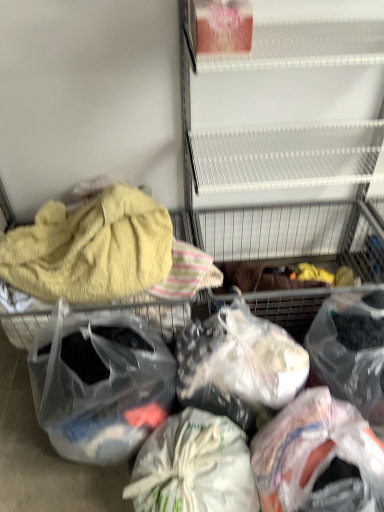
Question: Is translucent plastic bag at lower right, positioned as the 5th plastic bag in left-to-right order, thinner than yellow fluffy towel at left?

Choices:
 (A) yes
 (B) no

Answer: (A)

Question: Does translucent plastic bag at lower right, positioned as the 5th plastic bag in left-to-right order, have a lesser height compared to yellow fluffy towel at left?

Choices:
 (A) no
 (B) yes

Answer: (A)

Question: Does translucent plastic bag at lower right, positioned as the 1th plastic bag in right-to-left order, have a greater width compared to yellow fluffy towel at left?

Choices:
 (A) yes
 (B) no

Answer: (B)

Question: Is translucent plastic bag at lower right, positioned as the 1th plastic bag in right-to-left order, looking in the opposite direction of yellow fluffy towel at left?

Choices:
 (A) yes
 (B) no

Answer: (B)

Question: Can you see translucent plastic bag at lower right, positioned as the 1th plastic bag in right-to-left order, touching yellow fluffy towel at left?

Choices:
 (A) no
 (B) yes

Answer: (A)

Question: Is translucent plastic bag at lower right, positioned as the 5th plastic bag in left-to-right order, closer to camera compared to yellow fluffy towel at left?

Choices:
 (A) yes
 (B) no

Answer: (A)

Question: Is yellow fluffy towel at left aimed at white fabric bag at center, acting as the 4th plastic bag starting from the right?

Choices:
 (A) yes
 (B) no

Answer: (B)

Question: Is yellow fluffy towel at left positioned before white fabric bag at center, acting as the 4th plastic bag starting from the right?

Choices:
 (A) yes
 (B) no

Answer: (B)

Question: Is yellow fluffy towel at left to the left of white fabric bag at center, which is the second plastic bag in left-to-right order, from the viewer's perspective?

Choices:
 (A) yes
 (B) no

Answer: (A)

Question: Is yellow fluffy towel at left far away from white fabric bag at center, acting as the 4th plastic bag starting from the right?

Choices:
 (A) no
 (B) yes

Answer: (A)

Question: Can you confirm if yellow fluffy towel at left is bigger than white fabric bag at center, which is the second plastic bag in left-to-right order?

Choices:
 (A) no
 (B) yes

Answer: (B)

Question: Considering the relative positions of yellow fluffy towel at left and white fabric bag at center, which is the second plastic bag in left-to-right order, in the image provided, is yellow fluffy towel at left behind white fabric bag at center, which is the second plastic bag in left-to-right order,?

Choices:
 (A) yes
 (B) no

Answer: (A)

Question: From the image's perspective, does translucent plastic bag at lower right, positioned as the 1th plastic bag in right-to-left order, appear lower than translucent plastic bag at center, acting as the 3th plastic bag starting from the left?

Choices:
 (A) yes
 (B) no

Answer: (A)